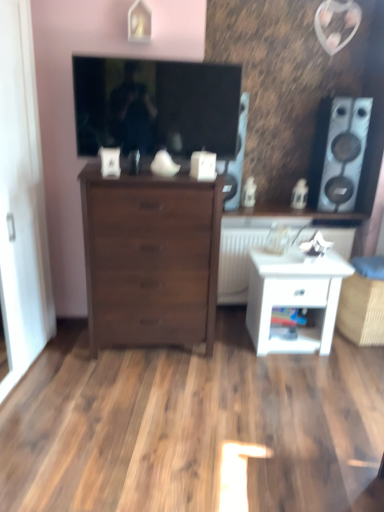
Question: Is white glossy nightstand at lower right in front of or behind white matte radiator at center in the image?

Choices:
 (A) behind
 (B) front

Answer: (B)

Question: Looking at the image, does white glossy nightstand at lower right seem bigger or smaller compared to white matte radiator at center?

Choices:
 (A) small
 (B) big

Answer: (A)

Question: Based on their relative distances, which object is farther from the dark wood chest of drawers at center?

Choices:
 (A) white glossy nightstand at lower right
 (B) white glossy speaker at right, marked as the first speaker in a right-to-left arrangement
 (C) matte black tv at upper center
 (D) white matte radiator at center
 (E) wooden cabinet at center

Answer: (B)

Question: Which of these objects is positioned closest to the wooden cabinet at center?

Choices:
 (A) white glossy speaker at right, marked as the first speaker in a right-to-left arrangement
 (B) white matte radiator at center
 (C) white glossy nightstand at lower right
 (D) matte black speaker at upper center, which is the second speaker in right-to-left order
 (E) dark wood chest of drawers at center

Answer: (B)